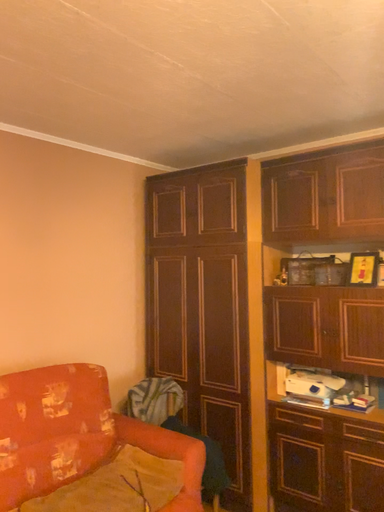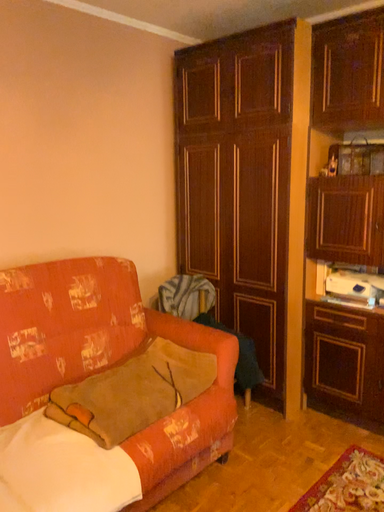
Question: How did the camera likely rotate when shooting the video?

Choices:
 (A) rotated downward
 (B) rotated upward

Answer: (A)